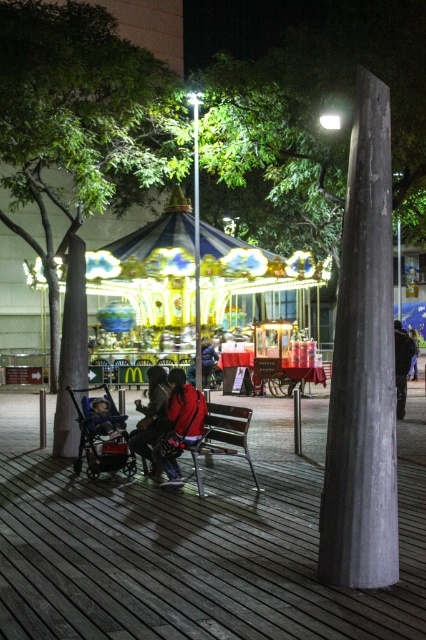
You are a parent pushing a stroller through the park. The stroller requires a clear path of at least 5 meters between obstacles to maneuver safely. Are the green leafy tree at left and shiny metallic carousel at center positioned far enough apart to allow safe passage?

The green leafy tree at left and shiny metallic carousel at center are 4.83 meters apart, which is less than the required 5 meters. Therefore, the path between them is too narrow for safe stroller maneuvering.

From the picture: You are a parent trying to push your stroller through the narrow path between the shiny metallic carousel at center and the matte black stroller at lower left. Can you pass through without hitting either object?

The shiny metallic carousel at center is positioned over the matte black stroller at lower left, which means there is no space between them. Therefore, you cannot push the stroller through without hitting either object.